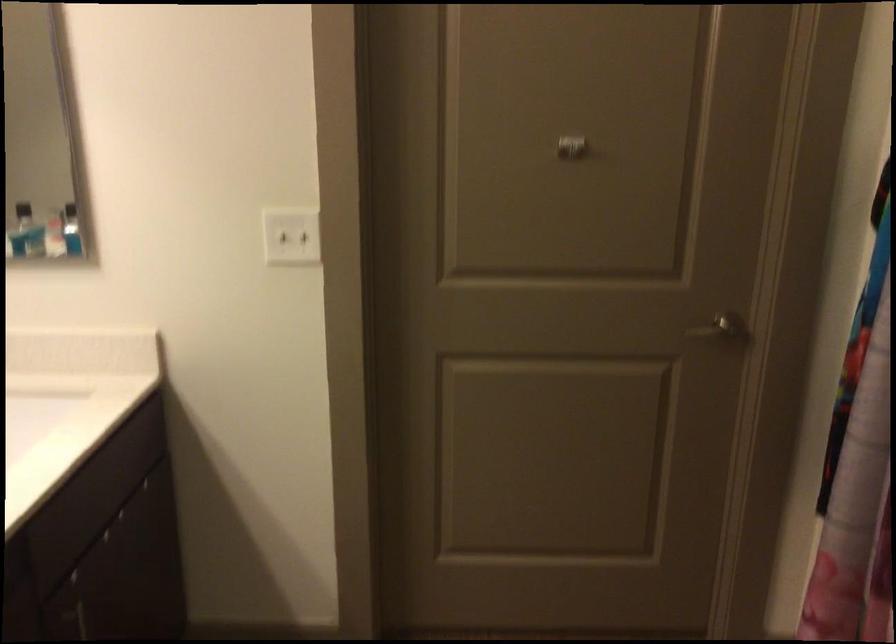
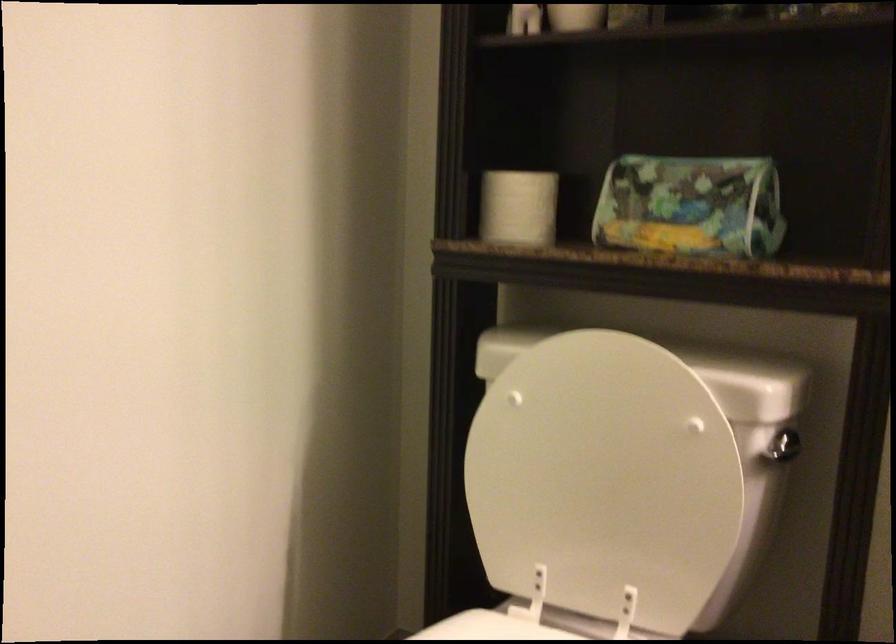
First-person continuous shooting, in which direction is the camera rotating?

The rotation direction of the camera is left-down.